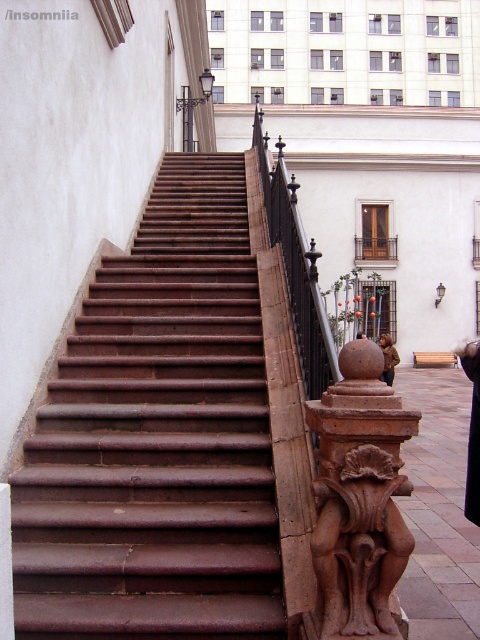
Which of these two, brown stone stairs at center or black wrought iron railing at upper center, stands taller?

black wrought iron railing at upper center

Between point (263, 464) and point (284, 182), which one is positioned behind?

Point (284, 182)

You are a GUI agent. You are given a task and a screenshot of the screen. Output one action in this format:
    pyautogui.click(x=<x>, y=<y>)
    Task: Click on the brown stone stairs at center
    The image size is (480, 640).
    Given the screenshot: What is the action you would take?
    pyautogui.click(x=156, y=438)

Is brown stone stairs at center further to camera compared to brown stone carving at center?

Yes.

You are a GUI agent. You are given a task and a screenshot of the screen. Output one action in this format:
    pyautogui.click(x=<x>, y=<y>)
    Task: Click on the brown stone stairs at center
    The image size is (480, 640).
    Given the screenshot: What is the action you would take?
    pyautogui.click(x=156, y=438)

Does point (238, 177) come in front of point (360, 634)?

No, it is not.

Locate an element on the screen. brown stone stairs at center is located at coordinates (156, 438).

Between brown stone carving at center and black wrought iron railing at upper center, which one has more height?

black wrought iron railing at upper center is taller.

Which is behind, point (407, 560) or point (298, 352)?

Point (298, 352)

Does point (396, 483) come closer to viewer compared to point (312, 348)?

Yes, it is.

Identify the location of brown stone carving at center. The width and height of the screenshot is (480, 640). (357, 547).